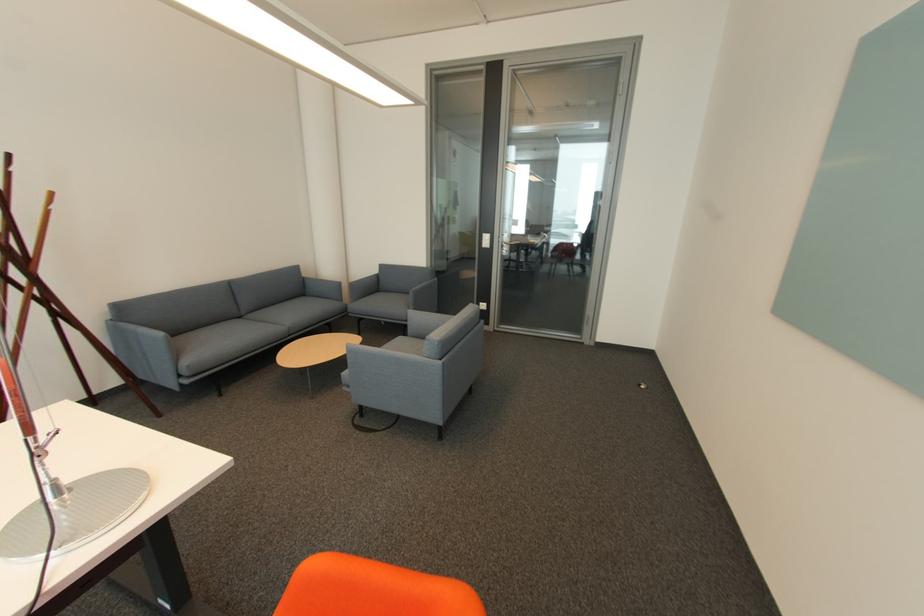
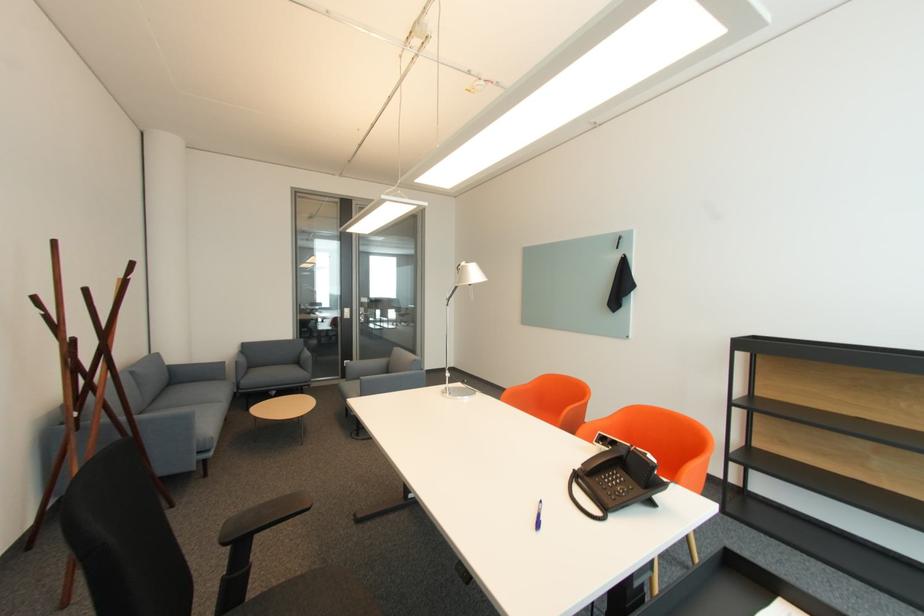
Find the pixel in the second image that matches the point at 407,293 in the first image.

(282, 365)